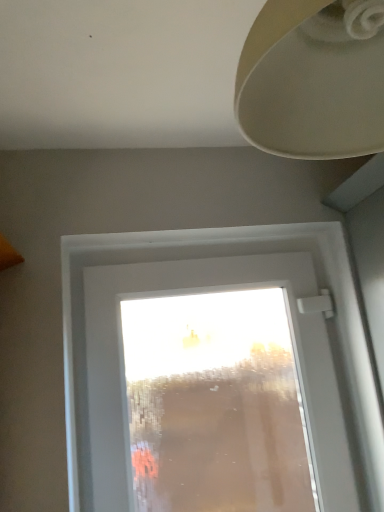
Question: Is matte beige lampshade at upper right in front of or behind transparent glass window at center in the image?

Choices:
 (A) front
 (B) behind

Answer: (A)

Question: Is matte beige lampshade at upper right taller or shorter than transparent glass window at center?

Choices:
 (A) tall
 (B) short

Answer: (B)

Question: In terms of size, does matte beige lampshade at upper right appear bigger or smaller than transparent glass window at center?

Choices:
 (A) big
 (B) small

Answer: (B)

Question: Relative to matte beige lampshade at upper right, is transparent glass window at center in front or behind?

Choices:
 (A) behind
 (B) front

Answer: (A)

Question: Is transparent glass window at center wider or thinner than matte beige lampshade at upper right?

Choices:
 (A) thin
 (B) wide

Answer: (A)

Question: From a real-world perspective, is transparent glass window at center positioned above or below matte beige lampshade at upper right?

Choices:
 (A) above
 (B) below

Answer: (B)

Question: Is point 99,359 closer or farther from the camera than point 269,40?

Choices:
 (A) farther
 (B) closer

Answer: (A)